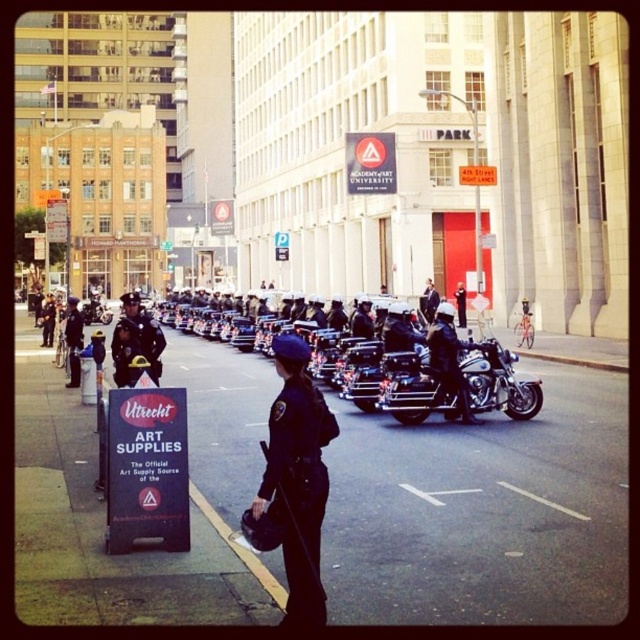
Question: Which point is closer to the camera?

Choices:
 (A) dark blue uniform at center
 (B) shiny black helmet at center
 (C) white painted line at center
 (D) shiny chrome motorcycle at center

Answer: (A)

Question: Is shiny chrome motorcycle at center bigger than shiny black helmet at center?

Choices:
 (A) no
 (B) yes

Answer: (A)

Question: Estimate the real-world distances between objects in this image. Which object is closer to the dark blue uniform at center?

Choices:
 (A) shiny chrome motorcycle at center
 (B) shiny black helmet at center

Answer: (A)

Question: Is dark blue uniform at center bigger than white painted line at center?

Choices:
 (A) no
 (B) yes

Answer: (B)

Question: Which of the following is the farthest from the observer?

Choices:
 (A) dark blue uniform at center
 (B) shiny chrome motorcycle at center
 (C) white painted line at center
 (D) shiny black helmet at center

Answer: (B)

Question: Is dark blue uniform at center to the right of shiny chrome motorcycle at center from the viewer's perspective?

Choices:
 (A) no
 (B) yes

Answer: (A)